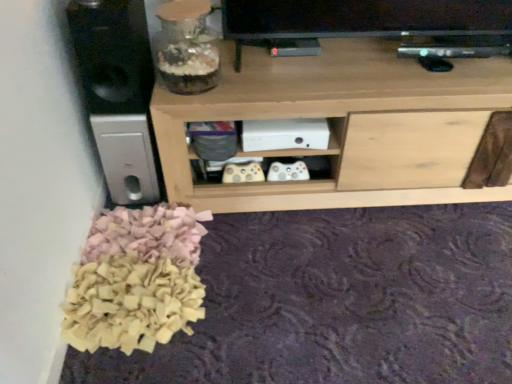
Question: From a real-world perspective, is black matte speaker at left positioned under translucent glass jar at upper left based on gravity?

Choices:
 (A) yes
 (B) no

Answer: (A)

Question: Does black matte speaker at left appear on the left side of translucent glass jar at upper left?

Choices:
 (A) no
 (B) yes

Answer: (B)

Question: From the image's perspective, is black matte speaker at left on translucent glass jar at upper left?

Choices:
 (A) yes
 (B) no

Answer: (A)

Question: Does black matte speaker at left have a smaller size compared to translucent glass jar at upper left?

Choices:
 (A) yes
 (B) no

Answer: (B)

Question: Is black matte speaker at left far from translucent glass jar at upper left?

Choices:
 (A) yes
 (B) no

Answer: (B)

Question: Does black matte speaker at left have a lesser width compared to translucent glass jar at upper left?

Choices:
 (A) yes
 (B) no

Answer: (B)

Question: From a real-world perspective, does natural wood shelf at center stand above black matte speaker at left?

Choices:
 (A) yes
 (B) no

Answer: (B)

Question: Does natural wood shelf at center have a smaller size compared to black matte speaker at left?

Choices:
 (A) yes
 (B) no

Answer: (B)

Question: Is natural wood shelf at center directly adjacent to black matte speaker at left?

Choices:
 (A) yes
 (B) no

Answer: (B)

Question: Would you say natural wood shelf at center is outside black matte speaker at left?

Choices:
 (A) yes
 (B) no

Answer: (A)

Question: Can you confirm if natural wood shelf at center is bigger than black matte speaker at left?

Choices:
 (A) no
 (B) yes

Answer: (B)

Question: Is natural wood shelf at center positioned far away from black matte speaker at left?

Choices:
 (A) yes
 (B) no

Answer: (B)

Question: Are black matte speaker at left and natural wood shelf at center making contact?

Choices:
 (A) yes
 (B) no

Answer: (B)